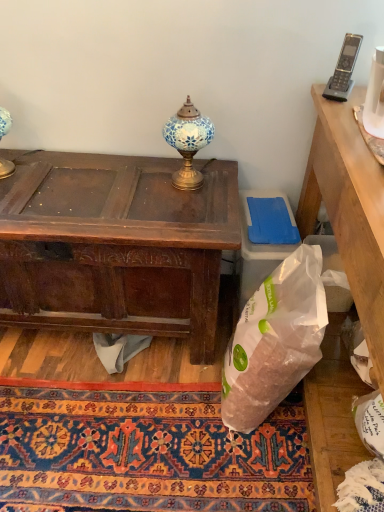
Image resolution: width=384 pixels, height=512 pixels. Find the location of `free space in front of blue mosaic lamp at center`. free space in front of blue mosaic lamp at center is located at coordinates (182, 204).